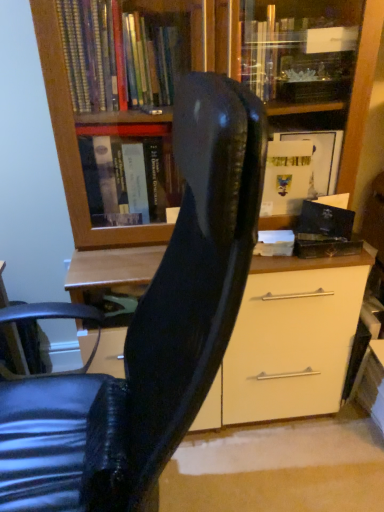
Question: Should I look upward or downward to see black leather chair at center?

Choices:
 (A) up
 (B) down

Answer: (B)